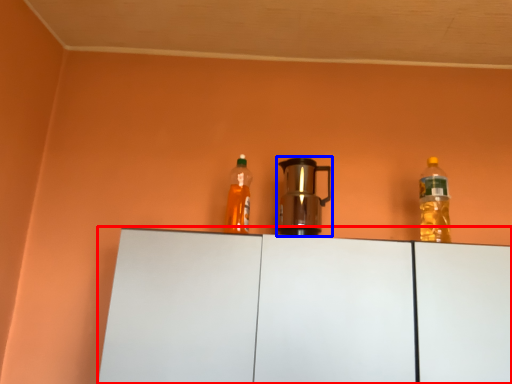
Question: Among these objects, which one is nearest to the camera, cabinetry (highlighted by a red box) or kitchen appliance (highlighted by a blue box)?

Choices:
 (A) cabinetry
 (B) kitchen appliance

Answer: (A)